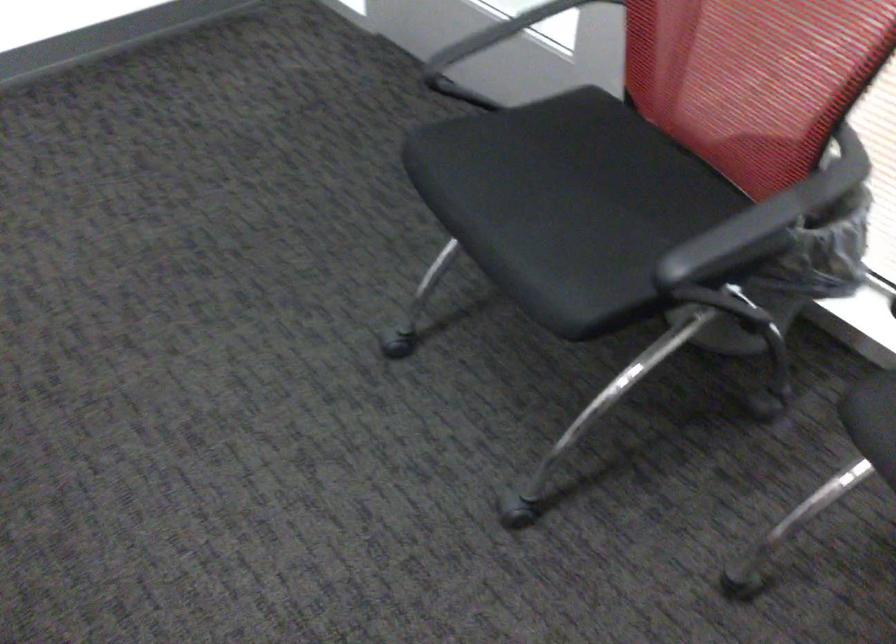
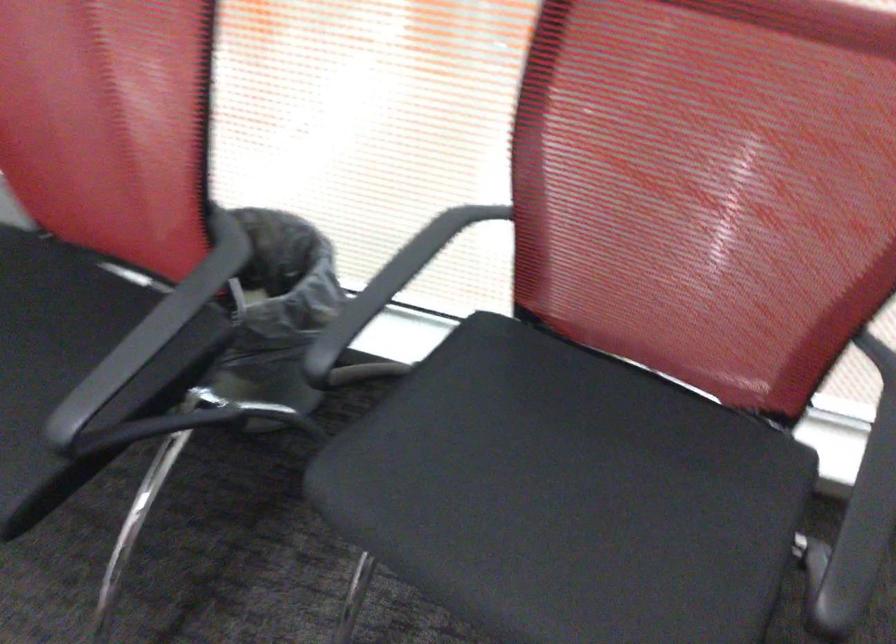
Locate, in the second image, the point that corresponds to the point at 644,223 in the first image.

(73, 366)